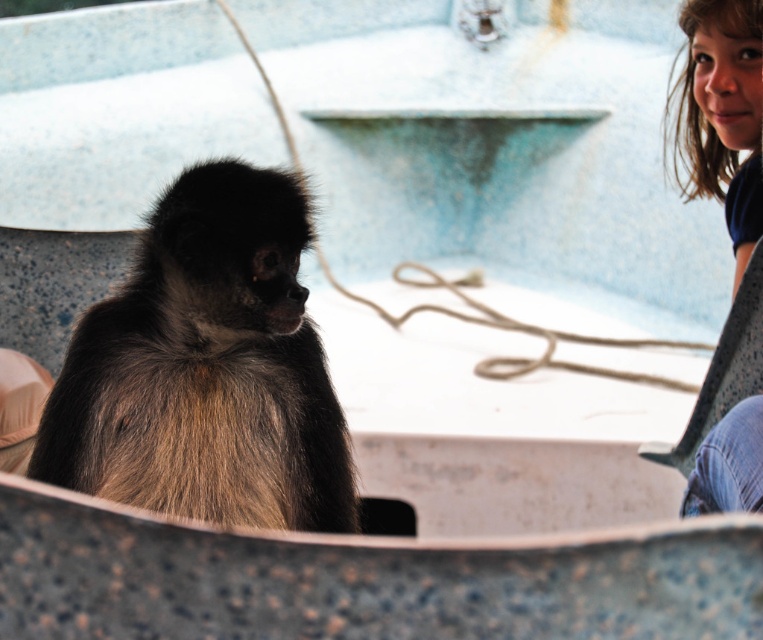
Question: Does brown furry monkey at center lie behind blue denim jeans at lower right?

Choices:
 (A) no
 (B) yes

Answer: (A)

Question: Which point appears farthest from the camera in this image?

Choices:
 (A) (269, 212)
 (B) (745, 252)

Answer: (B)

Question: Can you confirm if brown furry monkey at center is positioned below blue denim jeans at lower right?

Choices:
 (A) no
 (B) yes

Answer: (B)

Question: Which object is farther from the camera taking this photo?

Choices:
 (A) brown furry monkey at center
 (B) blue denim jeans at lower right

Answer: (B)

Question: Which point appears farthest from the camera in this image?

Choices:
 (A) (697, 3)
 (B) (198, 188)

Answer: (A)

Question: Can you confirm if brown furry monkey at center is wider than blue denim jeans at lower right?

Choices:
 (A) no
 (B) yes

Answer: (B)